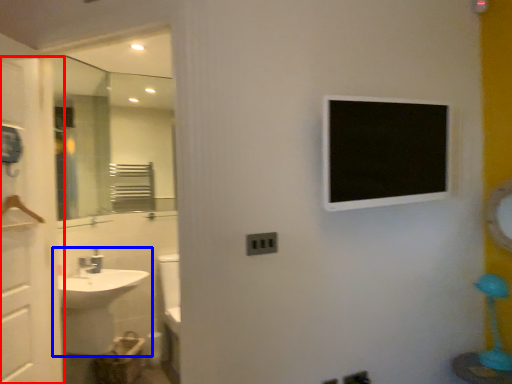
Question: Which of the following is the closest to the observer, screen door (highlighted by a red box) or sink (highlighted by a blue box)?

Choices:
 (A) screen door
 (B) sink

Answer: (A)